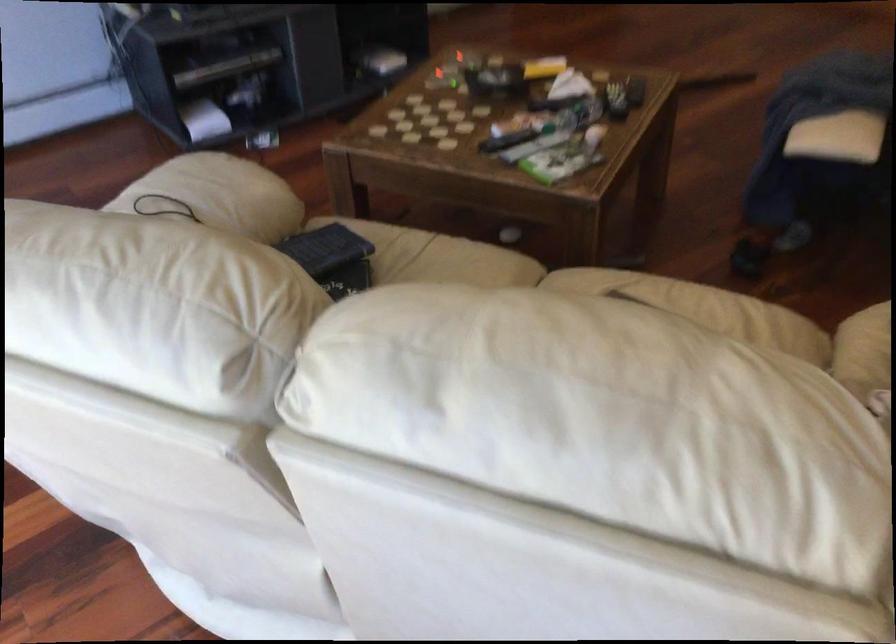
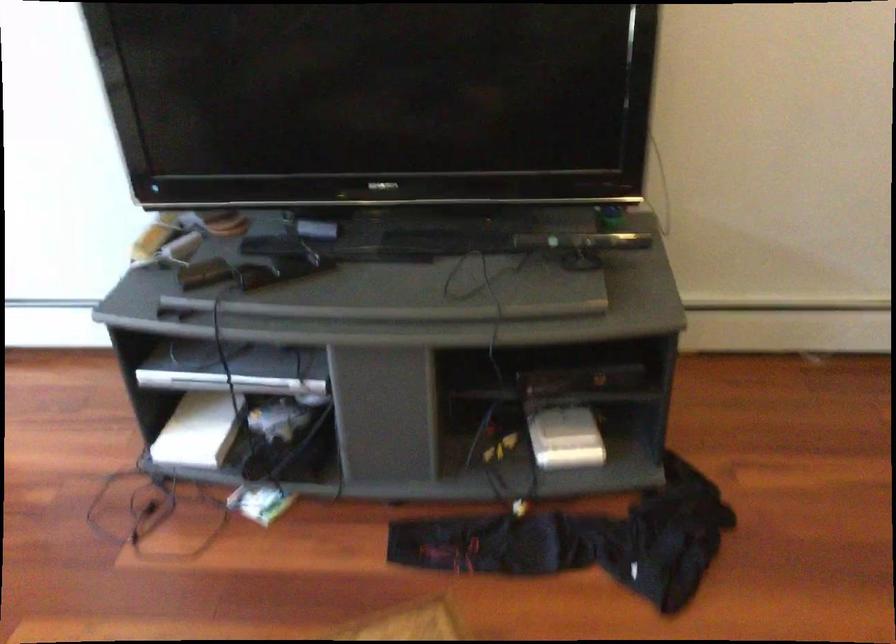
Where in the second image is the point corresponding to (209,109) from the first image?

(199, 430)